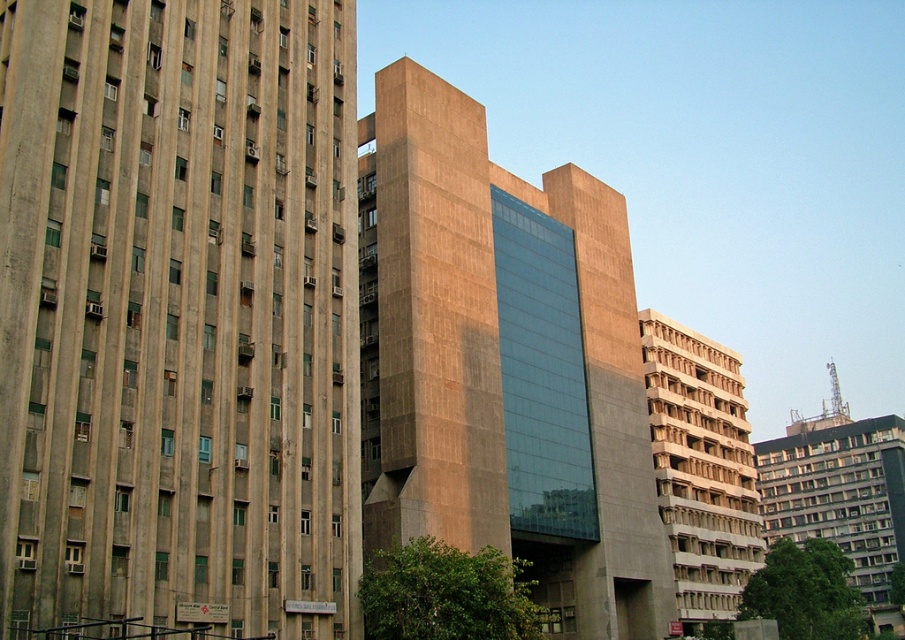
Is concrete building at left shorter than matte concrete building at center?

Yes, concrete building at left is shorter than matte concrete building at center.

Between point (353, 424) and point (454, 129), which one is positioned in front?

Positioned in front is point (353, 424).

Who is more forward, (184, 147) or (519, 525)?

Point (184, 147) is more forward.

Where is `concrete building at left`? concrete building at left is located at coordinates (178, 316).

Does concrete building at left have a greater width compared to white textured building at center?

No, concrete building at left is not wider than white textured building at center.

Who is more forward, (x=255, y=524) or (x=696, y=436)?

Point (x=255, y=524) is more forward.

This screenshot has height=640, width=905. Identify the location of concrete building at left. (178, 316).

Is matte concrete building at center positioned behind white textured building at center?

No, matte concrete building at center is in front of white textured building at center.

Can you confirm if matte concrete building at center is positioned to the left of white textured building at center?

Indeed, matte concrete building at center is positioned on the left side of white textured building at center.

Is point (374, 451) positioned after point (692, 396)?

That is False.

Find the location of a particular element. This screenshot has height=640, width=905. matte concrete building at center is located at coordinates (503, 364).